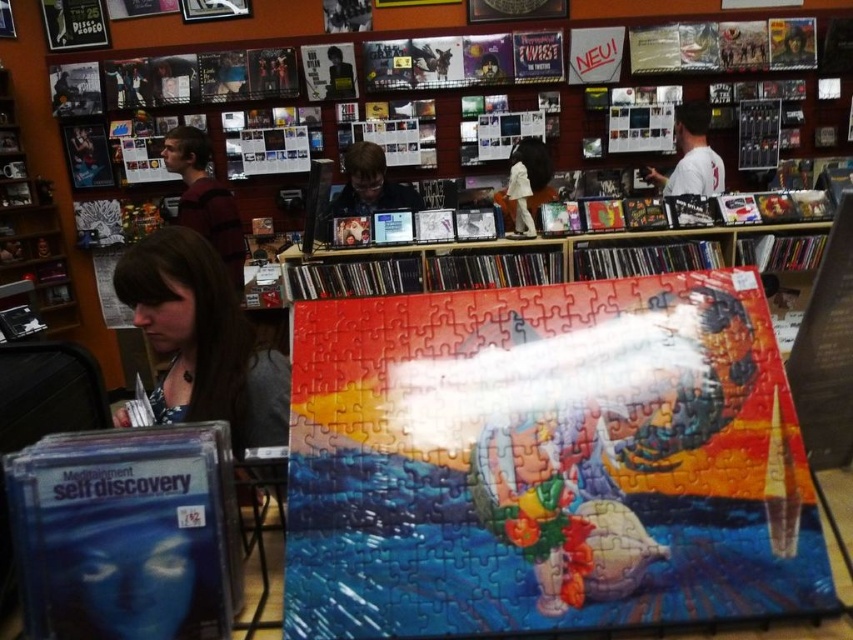
Is point (701, 116) farther from camera compared to point (529, 196)?

Yes, it is.

Between point (663, 192) and point (511, 156), which one is positioned in front?

Point (663, 192)

The height and width of the screenshot is (640, 853). What do you see at coordinates (691, 156) in the screenshot?
I see `white cotton shirt at upper right` at bounding box center [691, 156].

This screenshot has width=853, height=640. I want to click on white cotton shirt at upper right, so click(x=691, y=156).

Between point (392, 198) and point (325, 84), which one is positioned in front?

Point (392, 198) is in front.

Is matte black shirt at center to the left of matte black shirt at upper center from the viewer's perspective?

No, matte black shirt at center is not to the left of matte black shirt at upper center.

Between point (328, 237) and point (337, 81), which one is positioned behind?

The point (337, 81) is behind.

Where is `matte black shirt at center`? The height and width of the screenshot is (640, 853). matte black shirt at center is located at coordinates (367, 188).

Is maroon sweater at upper left to the left of white cotton shirt at upper right from the viewer's perspective?

Yes, maroon sweater at upper left is to the left of white cotton shirt at upper right.

Between maroon sweater at upper left and white cotton shirt at upper right, which one is positioned lower?

Positioned lower is maroon sweater at upper left.

Describe the element at coordinates (206, 198) in the screenshot. The image size is (853, 640). I see `maroon sweater at upper left` at that location.

You are a GUI agent. You are given a task and a screenshot of the screen. Output one action in this format:
    pyautogui.click(x=<x>, y=<y>)
    Task: Click on the maroon sweater at upper left
    The height and width of the screenshot is (640, 853).
    Given the screenshot: What is the action you would take?
    pyautogui.click(x=206, y=198)